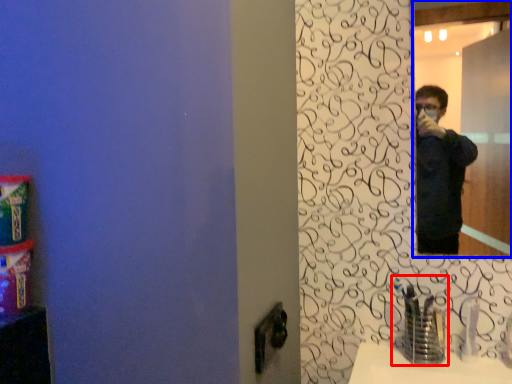
Question: Which object appears farthest to the camera in this image, faucet (highlighted by a red box) or mirror (highlighted by a blue box)?

Choices:
 (A) faucet
 (B) mirror

Answer: (B)